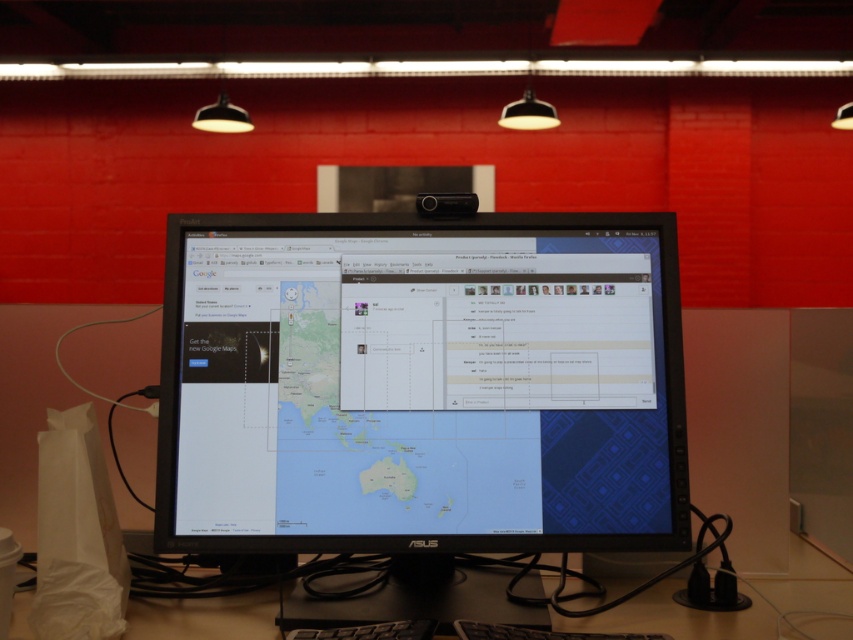
Is black glossy monitor at center positioned before black plastic computer desk at lower center?

Yes.

From the picture: Between black glossy monitor at center and black plastic computer desk at lower center, which one has more height?

Standing taller between the two is black glossy monitor at center.

Between point (363, 346) and point (177, 636), which one is positioned behind?

Positioned behind is point (363, 346).

The width and height of the screenshot is (853, 640). In order to click on black glossy monitor at center in this screenshot , I will do `click(421, 385)`.